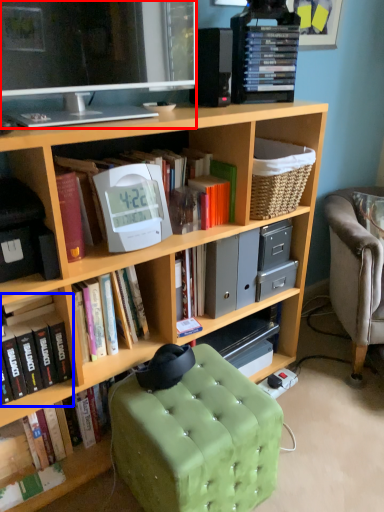
Question: Which object appears farthest to the camera in this image, television (highlighted by a red box) or book (highlighted by a blue box)?

Choices:
 (A) television
 (B) book

Answer: (B)